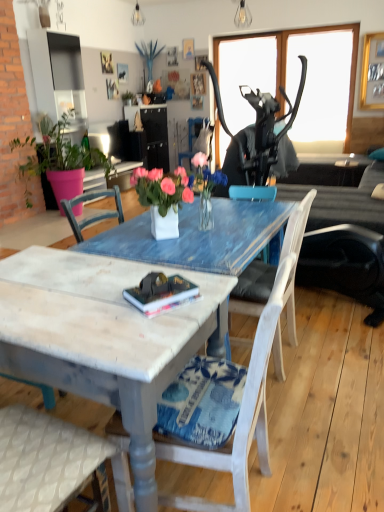
Describe the element at coordinates (149, 55) in the screenshot. I see `matte blue vase at upper center` at that location.

Find the location of a particular element. The width and height of the screenshot is (384, 512). white wood chair at center, which appears as the second chair when viewed from the back is located at coordinates (252, 289).

Measure the distance between green matte plant at left, the 1th houseplant when ordered from back to front, and camera.

The depth of green matte plant at left, the 1th houseplant when ordered from back to front, is 4.79 meters.

Locate an element on the screen. The image size is (384, 512). green matte plant at left, the 1th houseplant when ordered from back to front is located at coordinates (58, 160).

Describe the element at coordinates (320, 84) in the screenshot. I see `transparent glass window screen at upper right` at that location.

Image resolution: width=384 pixels, height=512 pixels. Find the location of `transparent glass window screen at upper right`. transparent glass window screen at upper right is located at coordinates (320, 84).

Where is `white ceramic vase at center, the 2th houseplant when ordered from top to bottom`? Image resolution: width=384 pixels, height=512 pixels. white ceramic vase at center, the 2th houseplant when ordered from top to bottom is located at coordinates (162, 198).

Describe the element at coordinates (346, 170) in the screenshot. I see `matte black side table at right` at that location.

Where is `matte black lampshade at upper center, acting as the 1th lamp starting from the top`? The width and height of the screenshot is (384, 512). matte black lampshade at upper center, acting as the 1th lamp starting from the top is located at coordinates (137, 16).

Identify the location of matte blue vase at upper center. The width and height of the screenshot is (384, 512). (149, 55).

Which object is positioned more to the right, transparent glass window screen at upper right or metallic bulb at upper center, placed as the 2th lamp when sorted from left to right?

From the viewer's perspective, transparent glass window screen at upper right appears more on the right side.

Is transparent glass window screen at upper right oriented away from metallic bulb at upper center, the 1th lamp in the bottom-to-top sequence?

transparent glass window screen at upper right is not turned away from metallic bulb at upper center, the 1th lamp in the bottom-to-top sequence.

From the image's perspective, between transparent glass window screen at upper right and metallic bulb at upper center, which is the first lamp from right to left, who is located below?

metallic bulb at upper center, which is the first lamp from right to left.

Between transparent glass window screen at upper right and metallic bulb at upper center, which is the first lamp from right to left, which one has smaller size?

metallic bulb at upper center, which is the first lamp from right to left.

Consider the image. Is green matte plant at left, the 1th houseplant when ordered from back to front, turned away from white ceramic vase at center, acting as the 2th houseplant starting from the back?

No, green matte plant at left, the 1th houseplant when ordered from back to front, is not facing away from white ceramic vase at center, acting as the 2th houseplant starting from the back.

Which of these two, green matte plant at left, the 1th houseplant when ordered from back to front, or white ceramic vase at center, arranged as the 2th houseplant when viewed from the left, is bigger?

Bigger between the two is green matte plant at left, the 1th houseplant when ordered from back to front.

Is green matte plant at left, which is the second houseplant from right to left, taller or shorter than white ceramic vase at center, the 1th houseplant viewed from the front?

green matte plant at left, which is the second houseplant from right to left, is taller than white ceramic vase at center, the 1th houseplant viewed from the front.

What's the angular difference between green matte plant at left, the second houseplant positioned from the front, and white ceramic vase at center, the 1th houseplant in the right-to-left sequence,'s facing directions?

The facing directions of green matte plant at left, the second houseplant positioned from the front, and white ceramic vase at center, the 1th houseplant in the right-to-left sequence, are 139 degrees apart.

Could you tell me if matte blue vase at upper center is facing white fabric pillow at right?

No, matte blue vase at upper center does not turn towards white fabric pillow at right.

From the picture: Is white fabric pillow at right located within matte blue vase at upper center?

No, white fabric pillow at right is not surrounded by matte blue vase at upper center.

Locate an element on the screen. pillow in front of the matte blue vase at upper center is located at coordinates (378, 192).

Are matte blue vase at upper center and white fabric pillow at right far apart?

Absolutely, matte blue vase at upper center is distant from white fabric pillow at right.

Considering the points (381, 97) and (240, 309), which point is in front, point (381, 97) or point (240, 309)?

The point (240, 309) is in front.

From a real-world perspective, is wooden picture frame at upper right on white wood chair at center, the 2th chair in the bottom-to-top sequence?

Correct, in the physical world, wooden picture frame at upper right is higher than white wood chair at center, the 2th chair in the bottom-to-top sequence.

Find the location of a particular element. The image size is (384, 512). picture frame that is above the white wood chair at center, arranged as the second chair when viewed from the top (from the image's perspective) is located at coordinates (372, 73).

Is white ceramic vase at center, positioned as the first houseplant in bottom-to-top order, looking in the opposite direction of wooden picture frame at upper right?

No, white ceramic vase at center, positioned as the first houseplant in bottom-to-top order, is not facing the opposite direction of wooden picture frame at upper right.

Considering the points (150, 193) and (381, 46), which point is in front, point (150, 193) or point (381, 46)?

Positioned in front is point (150, 193).

Would you say white ceramic vase at center, the 1th houseplant in the right-to-left sequence, is to the left or to the right of wooden picture frame at upper right in the picture?

Clearly, white ceramic vase at center, the 1th houseplant in the right-to-left sequence, is on the left of wooden picture frame at upper right in the image.

Does white ceramic vase at center, acting as the 2th houseplant starting from the back, have a greater height compared to wooden picture frame at upper right?

No.

Is dark gray fabric couch at center positioned behind wooden picture frame at upper right?

No, dark gray fabric couch at center is closer to the viewer.

Is dark gray fabric couch at center next to wooden picture frame at upper right?

No, dark gray fabric couch at center is not in contact with wooden picture frame at upper right.

Considering the sizes of objects dark gray fabric couch at center and wooden picture frame at upper right in the image provided, who is wider, dark gray fabric couch at center or wooden picture frame at upper right?

Wider between the two is dark gray fabric couch at center.

Is the depth of white ceramic vase at center, the 1th houseplant viewed from the front, greater than that of matte black side table at right?

No, it is not.

From a real-world perspective, is white ceramic vase at center, the 1th houseplant viewed from the front, located beneath matte black side table at right?

Actually, white ceramic vase at center, the 1th houseplant viewed from the front, is physically above matte black side table at right in the real world.

Can you confirm if white ceramic vase at center, the 2th houseplant when ordered from top to bottom, is positioned to the right of matte black side table at right?

No, white ceramic vase at center, the 2th houseplant when ordered from top to bottom, is not to the right of matte black side table at right.

Can you tell me how much white ceramic vase at center, positioned as the first houseplant in bottom-to-top order, and matte black side table at right differ in facing direction?

55.4 degrees separate the facing orientations of white ceramic vase at center, positioned as the first houseplant in bottom-to-top order, and matte black side table at right.

Locate an element on the screen. The image size is (384, 512). window screen located on the right of metallic bulb at upper center, acting as the 2th lamp starting from the back is located at coordinates (320, 84).

Locate an element on the screen. The image size is (384, 512). houseplant on the left of the white ceramic vase at center, the 1th houseplant viewed from the front is located at coordinates (58, 160).

Which object lies nearer to the anchor point green matte plant at left, which is the second houseplant from right to left, white painted wood chair at center, which is the 3th chair from top to bottom, or transparent glass window screen at upper right?

The object closer to green matte plant at left, which is the second houseplant from right to left, is transparent glass window screen at upper right.

When comparing their distances from transparent glass window screen at upper right, does wooden picture frame at upper right or white ceramic vase at center, the 2th houseplant when ordered from top to bottom, seem closer?

Based on the image, wooden picture frame at upper right appears to be nearer to transparent glass window screen at upper right.

Based on their spatial positions, is white wood chair at center, which is counted as the first chair, starting from the top, or distressed wood coffee table at lower center closer to white ceramic vase at center, acting as the 2th houseplant starting from the back?

Based on the image, distressed wood coffee table at lower center appears to be nearer to white ceramic vase at center, acting as the 2th houseplant starting from the back.

Which object lies further to the anchor point distressed wood coffee table at lower center, white fabric pillow at right or wooden picture frame at upper right?

Among the two, wooden picture frame at upper right is located further to distressed wood coffee table at lower center.

When comparing their distances from distressed wood coffee table at lower center, does green matte plant at left, the second houseplant positioned from the front, or wooden picture frame at upper right seem closer?

The object closer to distressed wood coffee table at lower center is green matte plant at left, the second houseplant positioned from the front.

Looking at the image, which one is located further to white painted wood chair at center, the 3th chair in the back-to-front sequence, matte blue vase at upper center or white wood chair at center, acting as the first chair starting from the back?

The object further to white painted wood chair at center, the 3th chair in the back-to-front sequence, is matte blue vase at upper center.

When comparing their distances from white wood chair at center, arranged as the second chair when viewed from the top, does white ceramic vase at center, the 1th houseplant in the right-to-left sequence, or matte black lampshade at upper center, which is the second lamp in bottom-to-top order, seem further?

matte black lampshade at upper center, which is the second lamp in bottom-to-top order, lies further to white wood chair at center, arranged as the second chair when viewed from the top, than the other object.

Based on their spatial positions, is white fabric pillow at right or metallic bulb at upper center, positioned as the 2th lamp in top-to-bottom order, closer to dark gray fabric couch at center?

Based on the image, white fabric pillow at right appears to be nearer to dark gray fabric couch at center.

Where is `floral arrangement positioned between white ceramic vase at center, the 1th houseplant viewed from the front, and matte black lampshade at upper center, which is the 1th lamp in left-to-right order, from near to far`? This screenshot has height=512, width=384. floral arrangement positioned between white ceramic vase at center, the 1th houseplant viewed from the front, and matte black lampshade at upper center, which is the 1th lamp in left-to-right order, from near to far is located at coordinates (205, 187).

Find the location of a particular element. This screenshot has height=512, width=384. chair between white painted wood chair at center, acting as the first chair starting from the bottom, and pink glass vase at center from front to back is located at coordinates (252, 289).

Image resolution: width=384 pixels, height=512 pixels. What are the coordinates of `chair between hardcover book at center and matte black lampshade at upper center, acting as the 1th lamp starting from the top, in the front-back direction` in the screenshot? It's located at (252, 289).

The height and width of the screenshot is (512, 384). What are the coordinates of `couch located between pink glass vase at center and matte blue vase at upper center in the depth direction` in the screenshot? It's located at (347, 243).